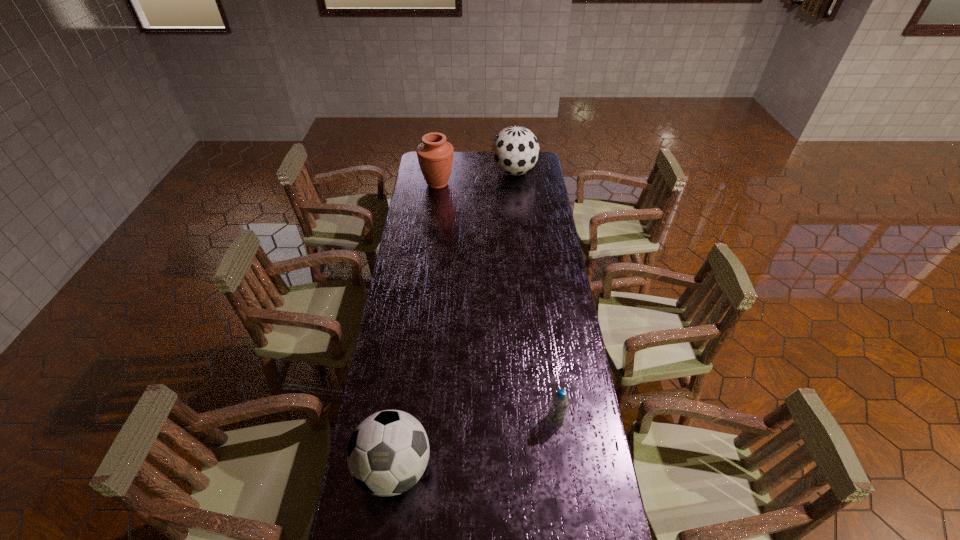
The image size is (960, 540). Identify the location of free location that satisfies the following two spatial constraints: 1. on the front side of the vase; 2. on the left side of the shortest object. (409, 418).